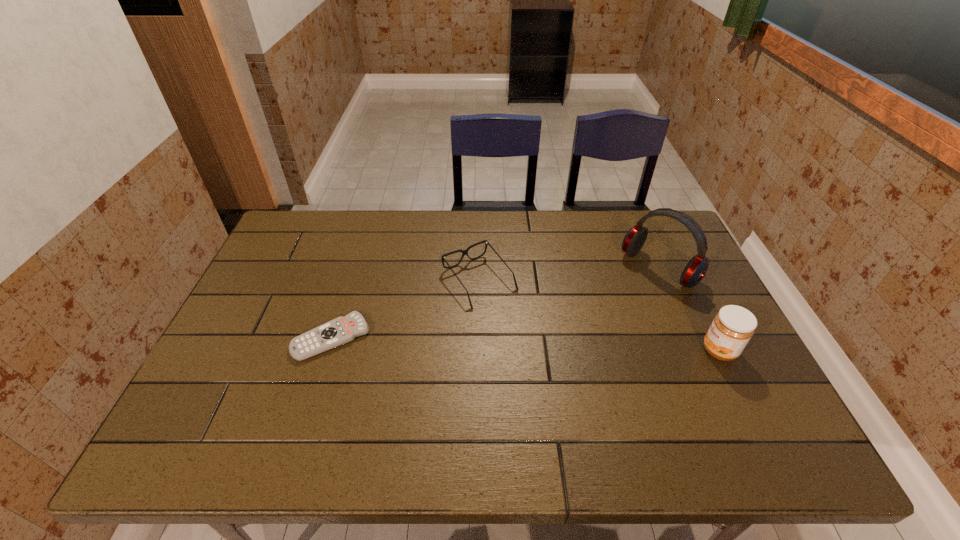
Find the location of a particular element. Image resolution: width=960 pixels, height=540 pixels. vacant space on the desktop that is between the leftmost object and the jam and is positioned with the lenses facing outward on the third tallest object is located at coordinates (532, 344).

Image resolution: width=960 pixels, height=540 pixels. In order to click on free space on the desktop that is between the remote control and the jam and is positioned on the ear cups of the earphone in this screenshot , I will do `click(570, 346)`.